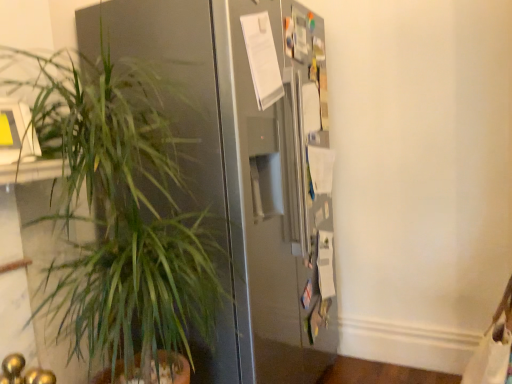
Question: From the image's perspective, is green leafy plant at left above or below satin silver refrigerator at center?

Choices:
 (A) below
 (B) above

Answer: (A)

Question: Looking at the image, does green leafy plant at left seem bigger or smaller compared to satin silver refrigerator at center?

Choices:
 (A) small
 (B) big

Answer: (A)

Question: Is green leafy plant at left spatially inside satin silver refrigerator at center, or outside of it?

Choices:
 (A) outside
 (B) inside

Answer: (A)

Question: From the image's perspective, is satin silver refrigerator at center positioned above or below green leafy plant at left?

Choices:
 (A) below
 (B) above

Answer: (B)

Question: Considering the positions of satin silver refrigerator at center and green leafy plant at left in the image, is satin silver refrigerator at center bigger or smaller than green leafy plant at left?

Choices:
 (A) small
 (B) big

Answer: (B)

Question: Does point (303, 21) appear closer or farther from the camera than point (197, 178)?

Choices:
 (A) closer
 (B) farther

Answer: (B)

Question: Relative to green leafy plant at left, is satin silver refrigerator at center in front or behind?

Choices:
 (A) behind
 (B) front

Answer: (A)